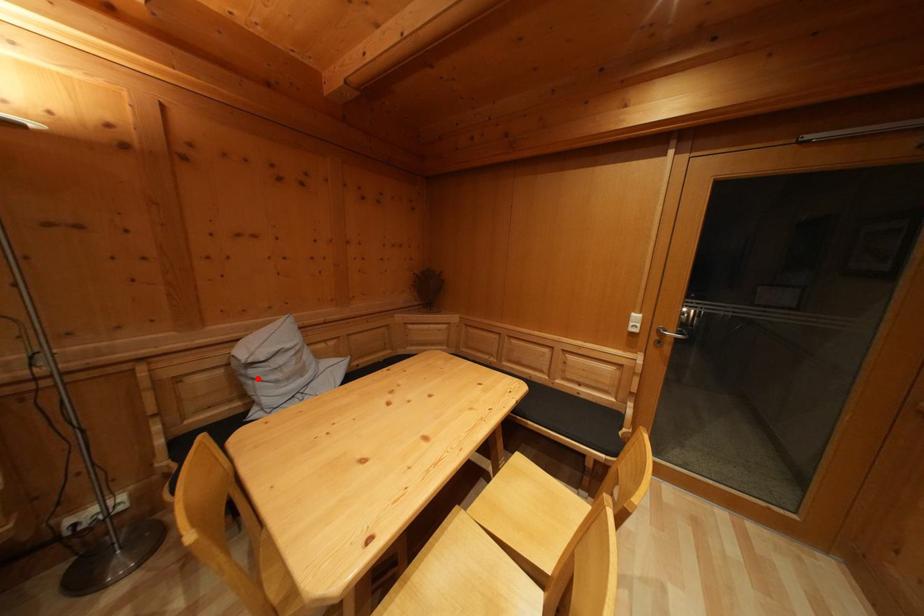
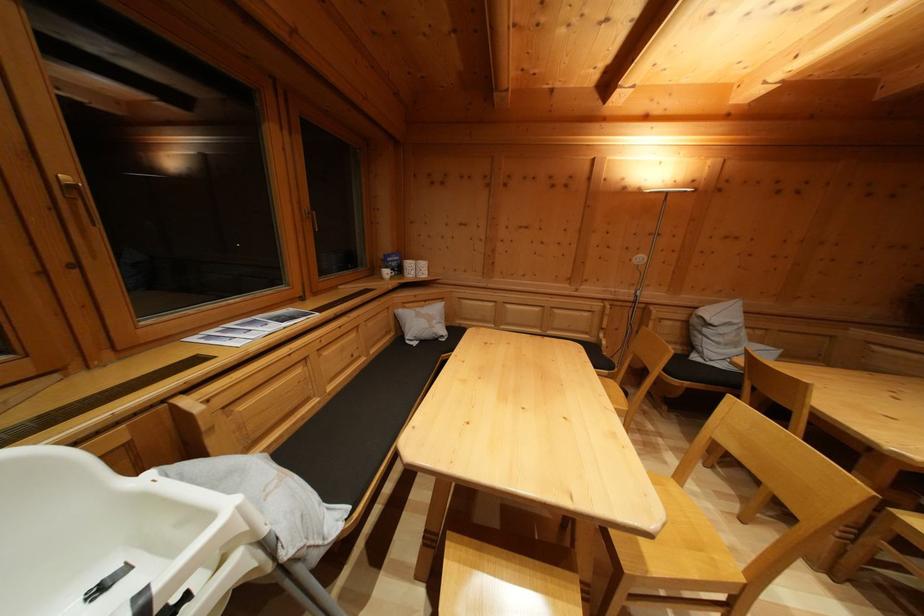
Where in the second image is the point corresponding to the highlighted location from the first image?

(711, 337)